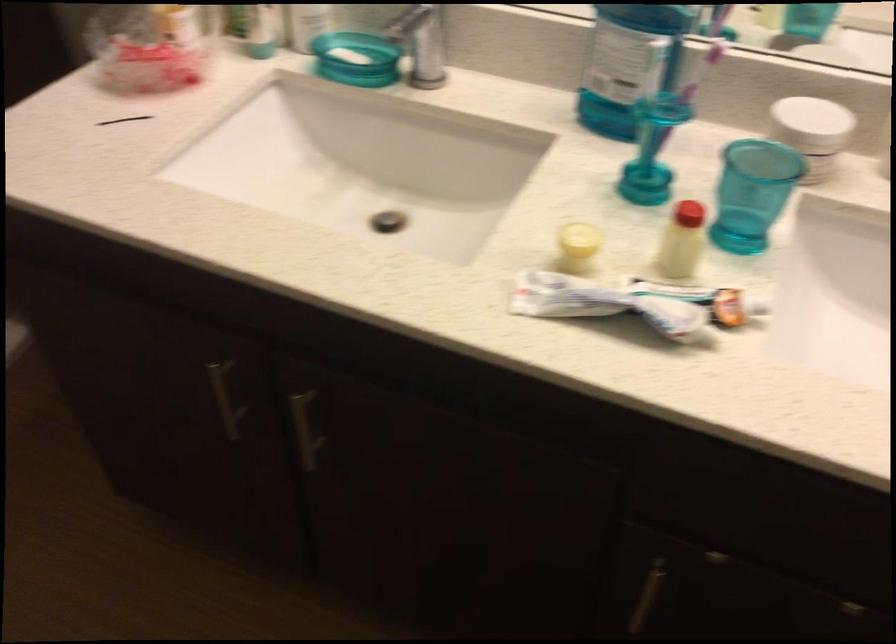
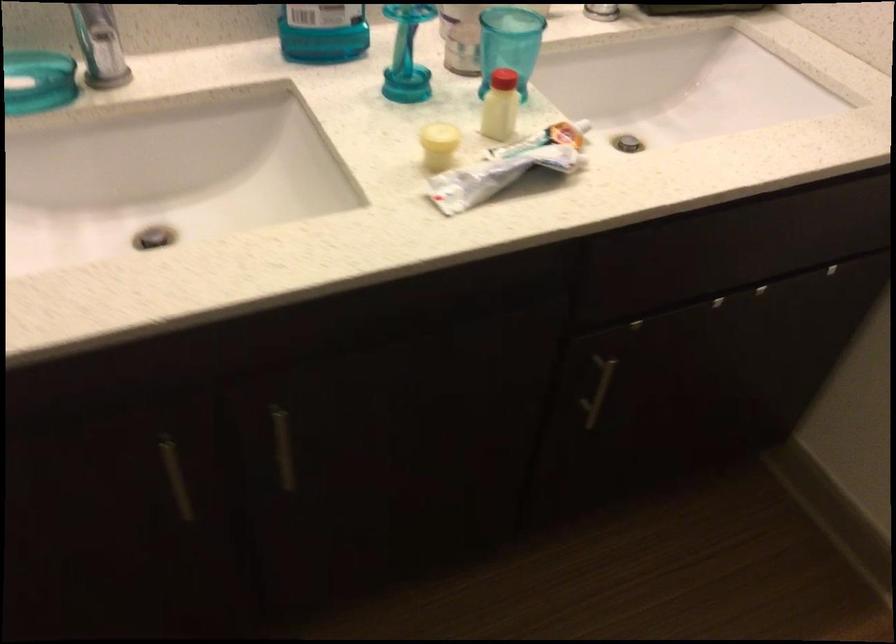
Find the pixel in the second image that matches (685,242) in the first image.

(501, 106)